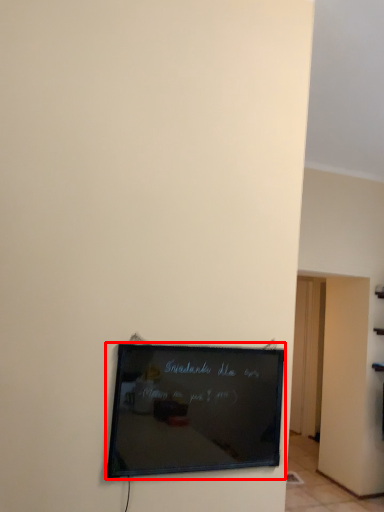
Question: In this image, where is picture frame (annotated by the red box) located relative to door?

Choices:
 (A) left
 (B) right

Answer: (A)